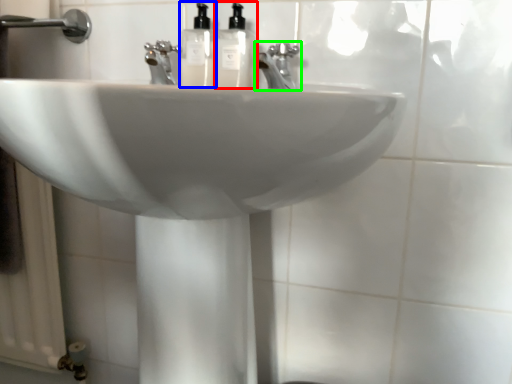
Question: Considering the real-world distances, which object is farthest from soap dispenser (highlighted by a red box)? soap dispenser (highlighted by a blue box) or tap (highlighted by a green box)?

Choices:
 (A) soap dispenser
 (B) tap

Answer: (B)